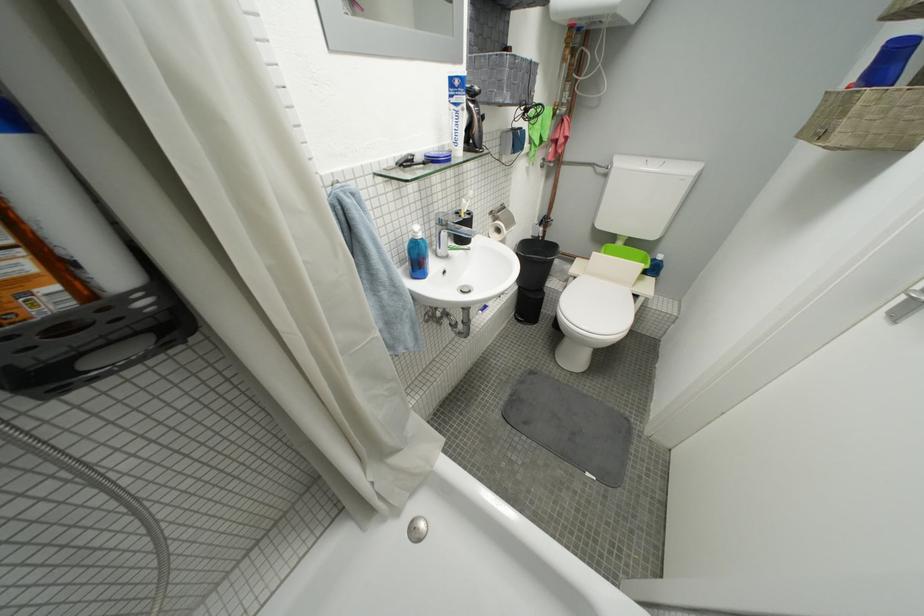
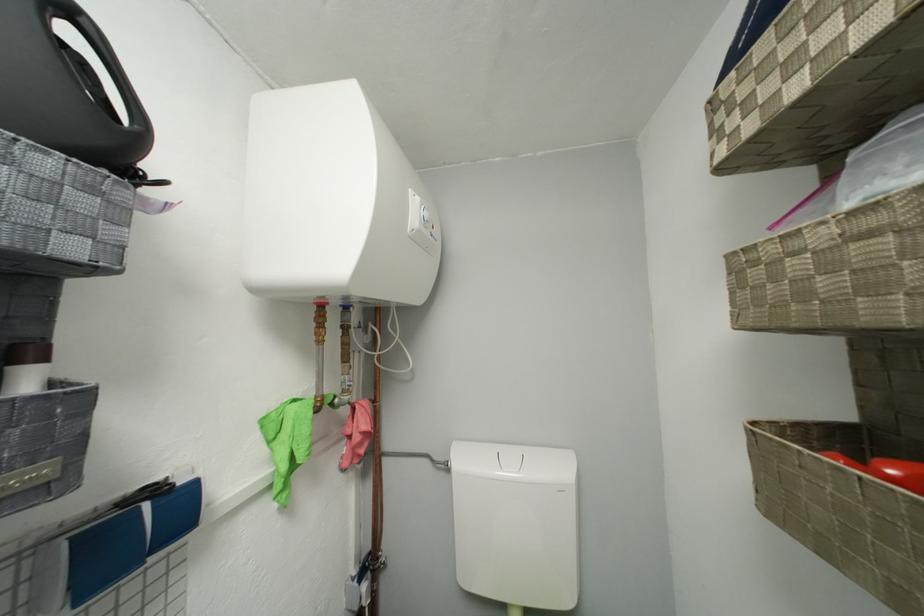
Where in the second image is the point corresponding to (x=545, y=145) from the first image?

(293, 469)